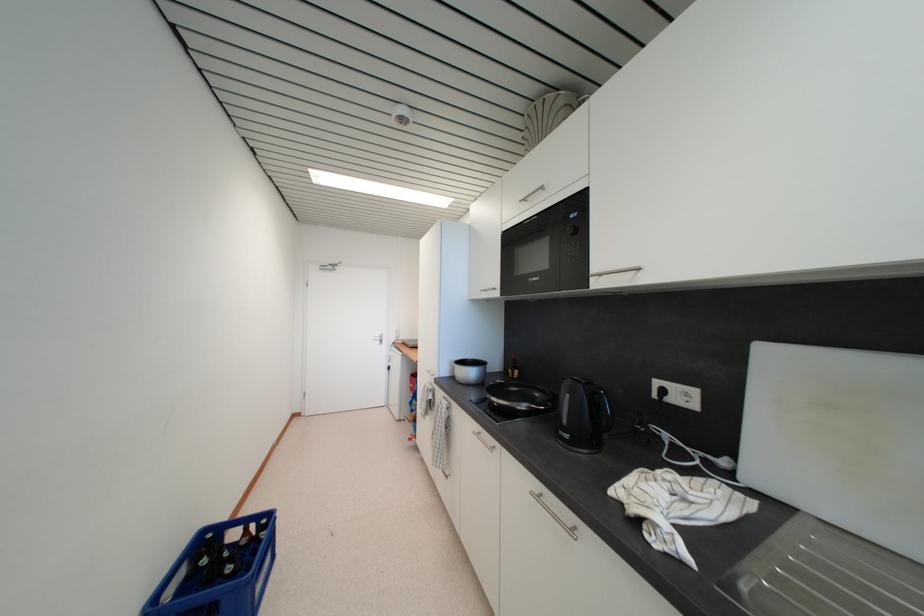
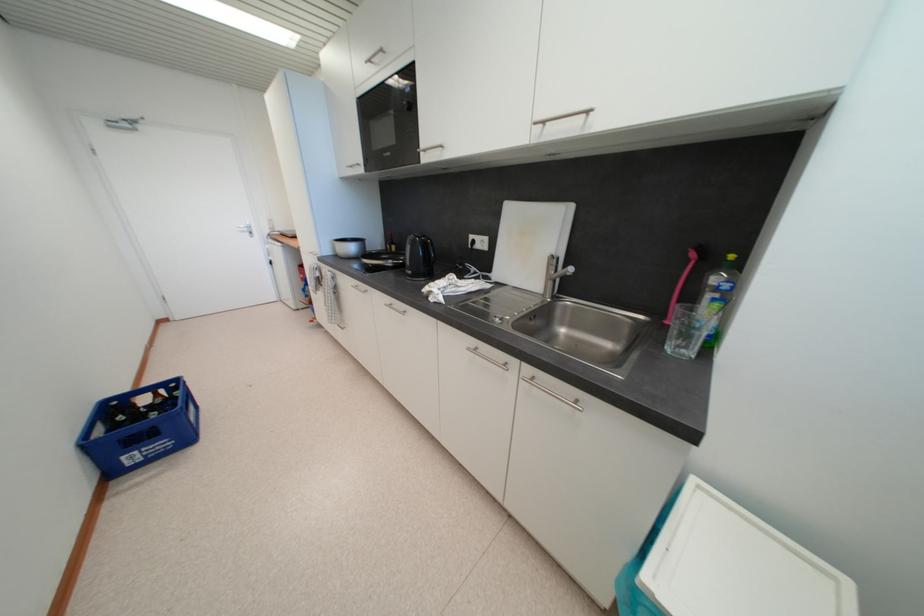
Locate, in the second image, the point that corresponds to the point at 482,430 in the first image.

(359, 285)